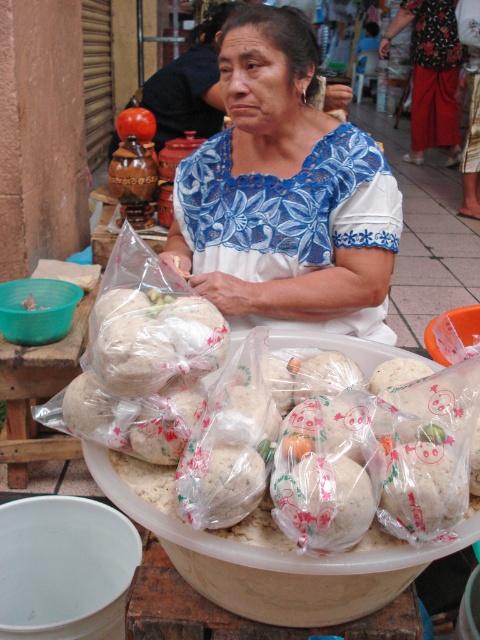
Is white lace blouse at center positioned at the back of translucent plastic table at lower left?

No, it is not.

Which is more to the left, white lace blouse at center or translucent plastic table at lower left?

From the viewer's perspective, translucent plastic table at lower left appears more on the left side.

Find the location of `white lace blouse at center`. white lace blouse at center is located at coordinates (285, 195).

Who is taller, translucent plastic table at lower left or translucent plastic bowl at lower left?

translucent plastic table at lower left

Is the position of translucent plastic table at lower left more distant than that of translucent plastic bowl at lower left?

Yes.

What do you see at coordinates (38, 394) in the screenshot? The image size is (480, 640). I see `translucent plastic table at lower left` at bounding box center [38, 394].

You are a GUI agent. You are given a task and a screenshot of the screen. Output one action in this format:
    pyautogui.click(x=<x>, y=<y>)
    Task: Click on the translucent plastic table at lower left
    The width and height of the screenshot is (480, 640).
    Given the screenshot: What is the action you would take?
    pyautogui.click(x=38, y=394)

In the scene shown: Which is above, white lace blouse at center or translucent plastic bowl at lower left?

white lace blouse at center is higher up.

Can you confirm if white lace blouse at center is smaller than translucent plastic bowl at lower left?

No, white lace blouse at center is not smaller than translucent plastic bowl at lower left.

Is point (237, 173) positioned in front of point (41, 308)?

Yes, it is.

Locate an element on the screen. The height and width of the screenshot is (640, 480). white lace blouse at center is located at coordinates (285, 195).